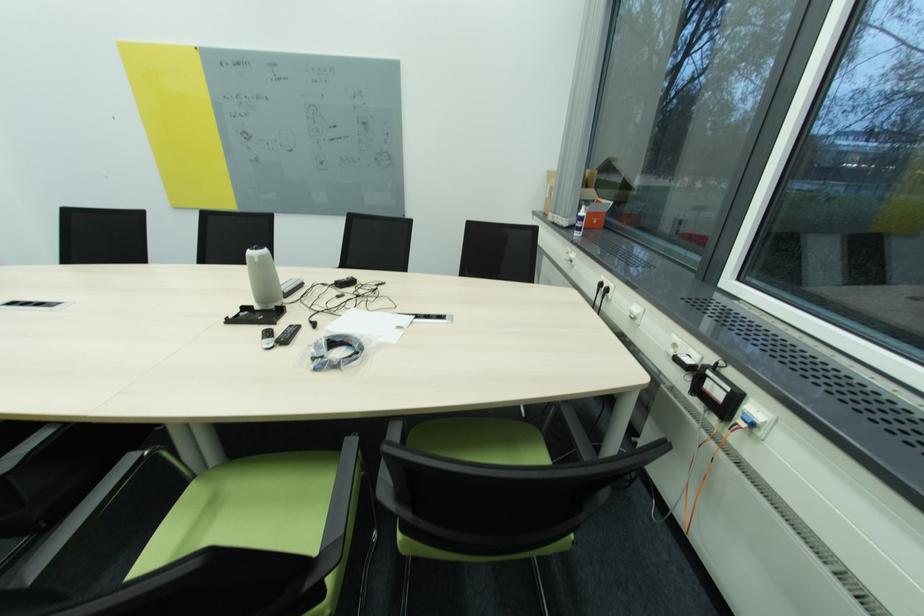
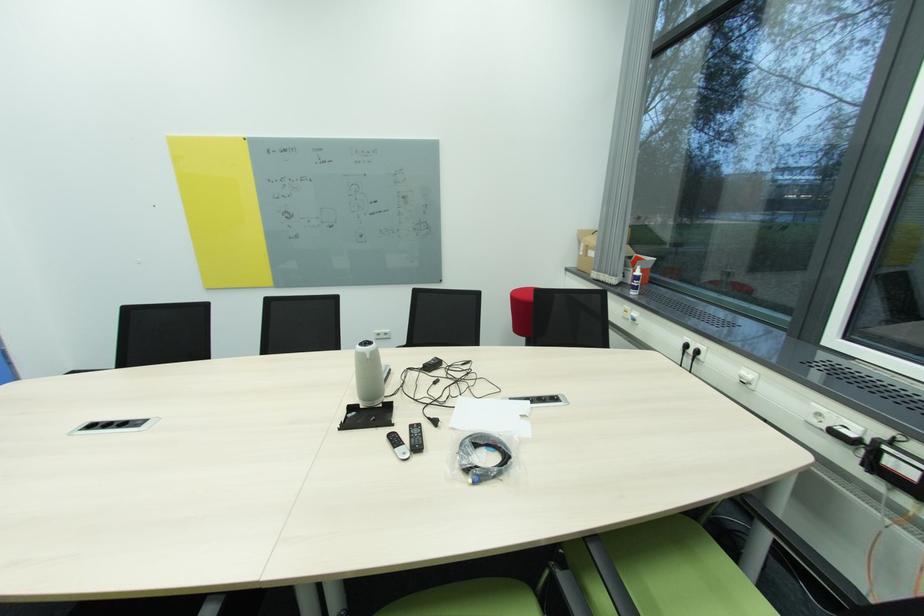
In the second image, find the point that corresponds to point (555, 191) in the first image.

(591, 249)